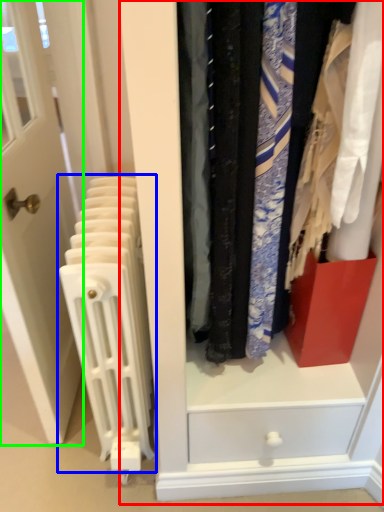
Question: Which object is positioned closest to dresser (highlighted by a red box)? Select from radiator (highlighted by a blue box) and door (highlighted by a green box).

Choices:
 (A) radiator
 (B) door

Answer: (A)